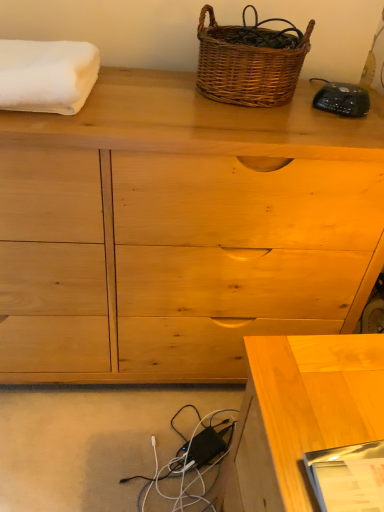
Question: In the image, is black plastic remote at upper right positioned in front of or behind woven brown picnic basket at upper center?

Choices:
 (A) front
 (B) behind

Answer: (B)

Question: Considering the positions of black plastic remote at upper right and woven brown picnic basket at upper center in the image, is black plastic remote at upper right wider or thinner than woven brown picnic basket at upper center?

Choices:
 (A) thin
 (B) wide

Answer: (A)

Question: Which object is the farthest from the black plastic remote at upper right?

Choices:
 (A) natural wood chest of drawers at center
 (B) light wood desk at lower right
 (C) white fluffy towel at upper left
 (D) woven brown picnic basket at upper center

Answer: (B)

Question: Which object is the closest to the black plastic remote at upper right?

Choices:
 (A) light wood desk at lower right
 (B) woven brown picnic basket at upper center
 (C) white fluffy towel at upper left
 (D) natural wood chest of drawers at center

Answer: (B)